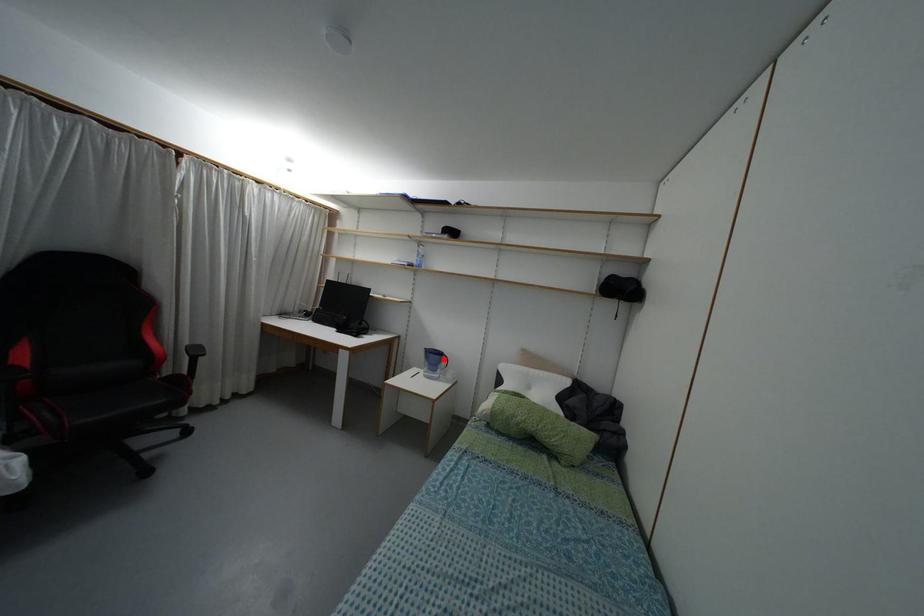
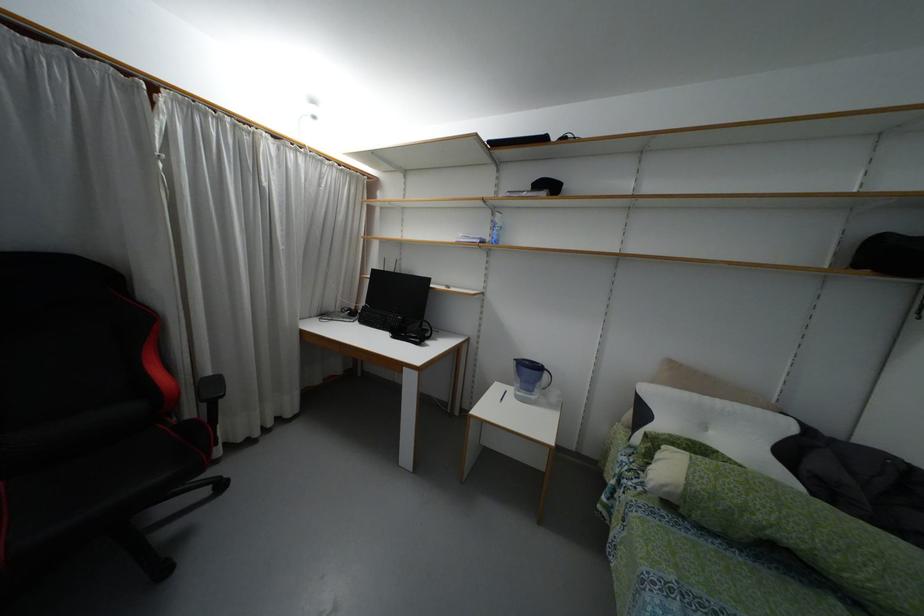
Where in the second image is the point corresponding to the highlighted location from the first image?

(544, 375)